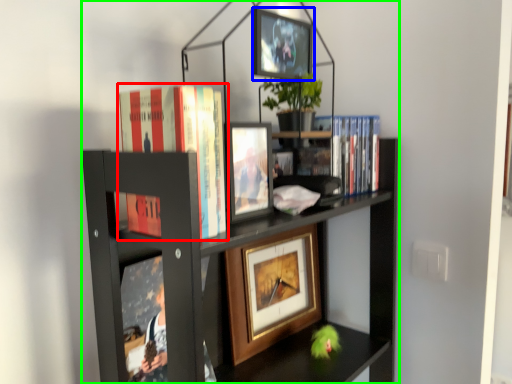
Question: Based on their relative distances, which object is nearer to book (highlighted by a red box)? Choose from picture frame (highlighted by a blue box) and bookcase (highlighted by a green box).

Choices:
 (A) picture frame
 (B) bookcase

Answer: (B)